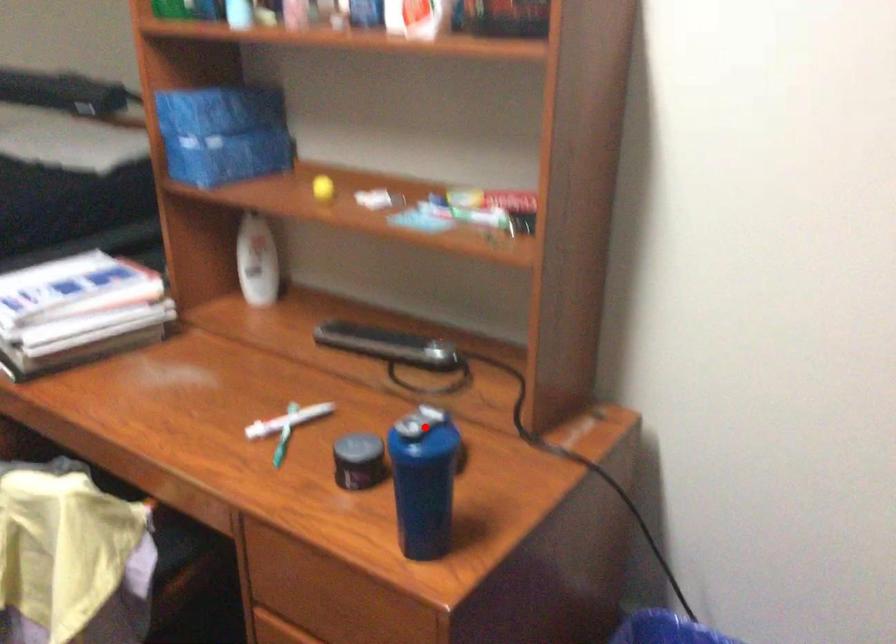
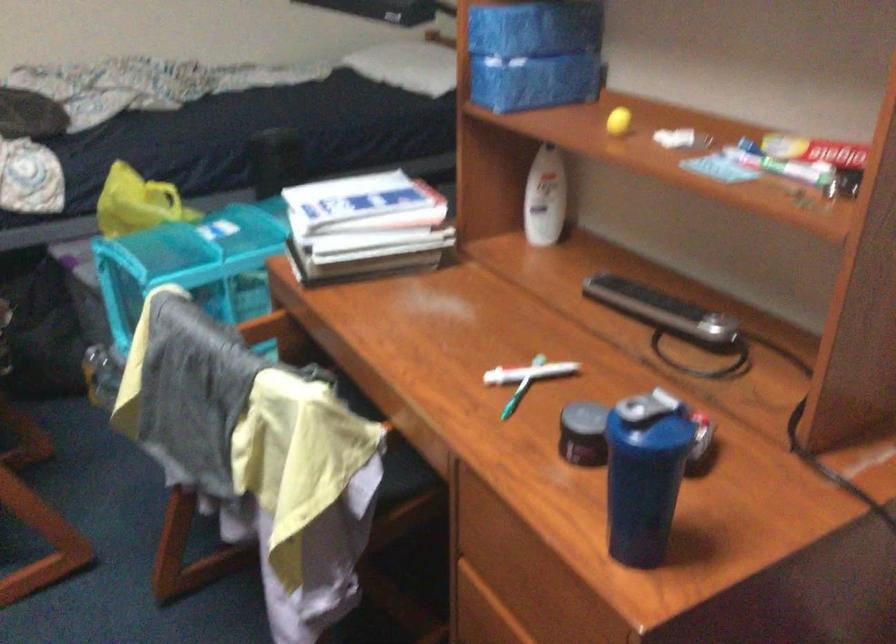
In the second image, find the point that corresponds to the highlighted location in the first image.

(650, 410)